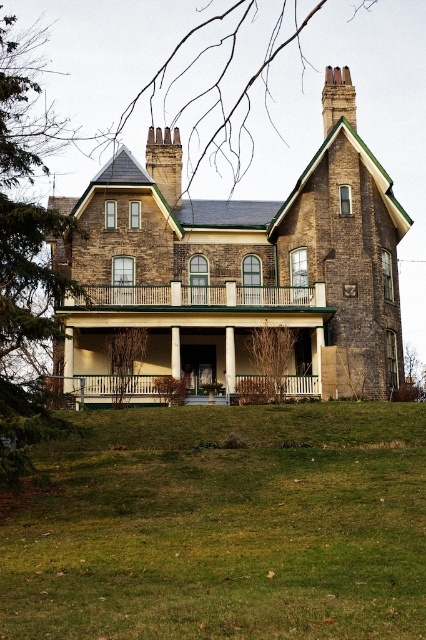
Is bare branches at upper center in front of white wood column at center?

That is False.

Who is lower down, bare branches at upper center or white wood column at center?

white wood column at center

You are a GUI agent. You are given a task and a screenshot of the screen. Output one action in this format:
    pyautogui.click(x=<x>, y=<y>)
    Task: Click on the bare branches at upper center
    The width and height of the screenshot is (426, 640).
    Given the screenshot: What is the action you would take?
    pyautogui.click(x=218, y=84)

Where is `bare branches at upper center`? This screenshot has height=640, width=426. bare branches at upper center is located at coordinates (218, 84).

Which is above, green grass at lower center or white painted wood pillar at center?

white painted wood pillar at center is higher up.

Locate an element on the screen. The height and width of the screenshot is (640, 426). green grass at lower center is located at coordinates (224, 528).

In the scene shown: Who is positioned more to the right, bare branches at upper center or white painted wood pillar at center?

Positioned to the right is bare branches at upper center.

Which is behind, point (187, 163) or point (176, 374)?

Point (187, 163)

This screenshot has width=426, height=640. Find the location of `bare branches at upper center`. bare branches at upper center is located at coordinates (218, 84).